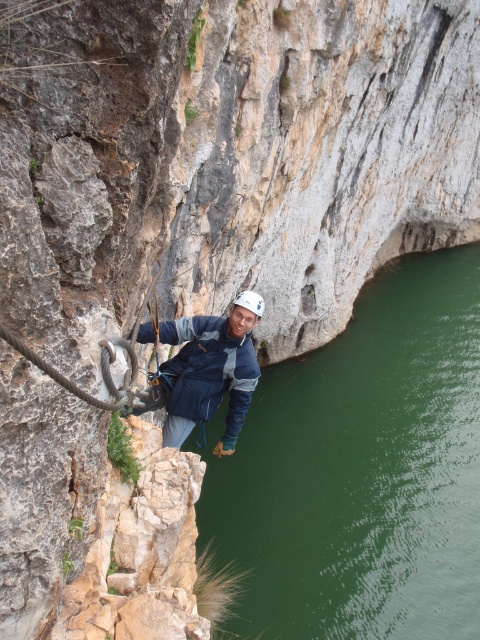
You are a climber planning to move from the point at coordinates point (x=20, y=340) to the point at coordinates point (x=240, y=301). Given the cliff face has loose rocks, which direction should you move relative to the other point?

You should move towards the point at coordinates point (x=240, y=301) because point (x=20, y=340) is in front of it, so the target point is behind and above the current position.

You are a safety inspector checking the equipment of a climber. You notice the black rubber rope at center and the white matte helmet at center. Which equipment has a smaller diameter?

The black rubber rope at center is thinner than the white matte helmet at center, so the black rubber rope at center has a smaller diameter.

You are a safety inspector checking the rappelling setup. You notice the blue fabric jacket at center and the black rubber rope at center. Which item has a greater width?

The blue fabric jacket at center has a greater width than the black rubber rope at center.